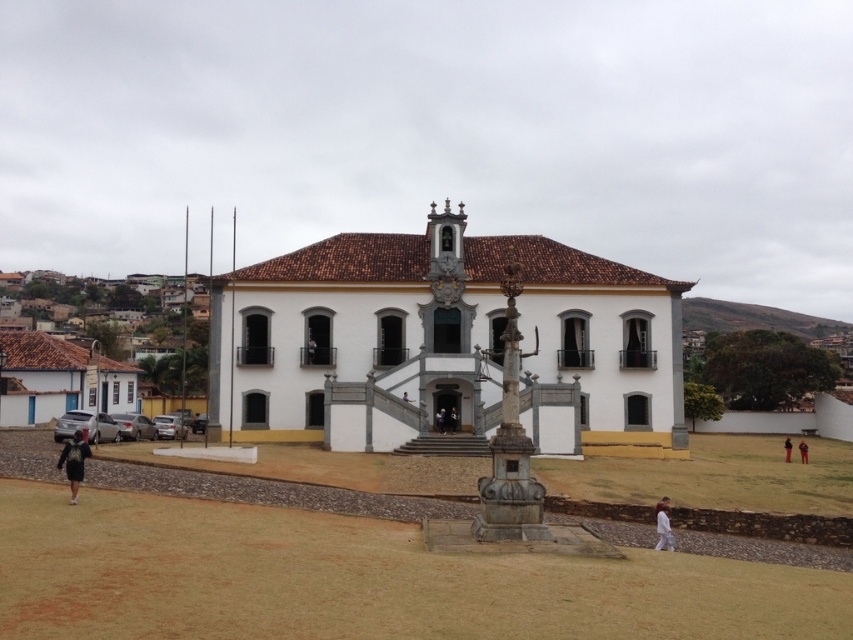
Which is in front, point (664, 506) or point (785, 449)?

Positioned in front is point (664, 506).

Does white fabric at lower right have a lesser height compared to orange fabric pants at lower right?

Indeed, white fabric at lower right has a lesser height compared to orange fabric pants at lower right.

The height and width of the screenshot is (640, 853). Describe the element at coordinates (663, 525) in the screenshot. I see `white fabric at lower right` at that location.

Find the location of `white fabric at lower right`. white fabric at lower right is located at coordinates (663, 525).

Can you confirm if white fabric pants at lower right is positioned below orange fabric pants at lower right?

No, white fabric pants at lower right is not below orange fabric pants at lower right.

Can you confirm if white fabric pants at lower right is wider than orange fabric pants at lower right?

In fact, white fabric pants at lower right might be narrower than orange fabric pants at lower right.

Find the location of a particular element. The width and height of the screenshot is (853, 640). white fabric pants at lower right is located at coordinates (662, 506).

I want to click on white fabric pants at lower right, so click(x=662, y=506).

Who is taller, dark gray backpack at lower left or white fabric at lower right?

Standing taller between the two is dark gray backpack at lower left.

From the picture: Which is below, dark gray backpack at lower left or white fabric at lower right?

white fabric at lower right

Which is behind, point (76, 497) or point (669, 524)?

Positioned behind is point (669, 524).

You are a GUI agent. You are given a task and a screenshot of the screen. Output one action in this format:
    pyautogui.click(x=<x>, y=<y>)
    Task: Click on the dark gray backpack at lower left
    
    Given the screenshot: What is the action you would take?
    pyautogui.click(x=74, y=461)